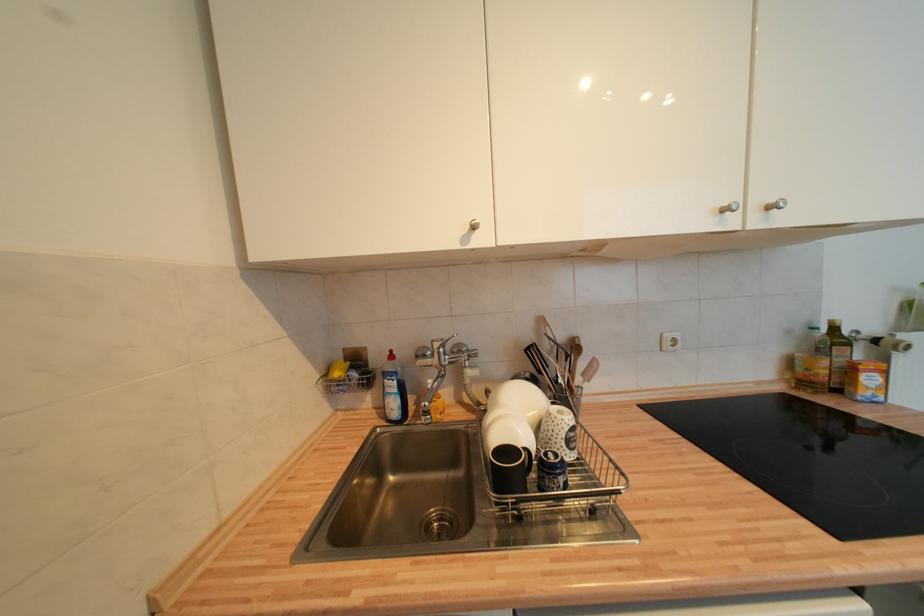
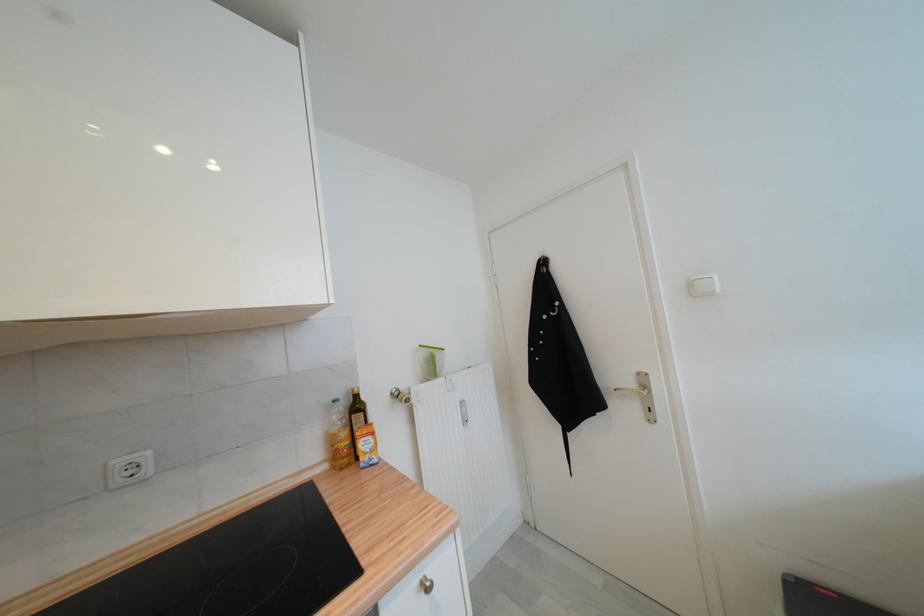
In the second image, find the point that corresponds to the point at 673,338 in the first image.

(126, 464)